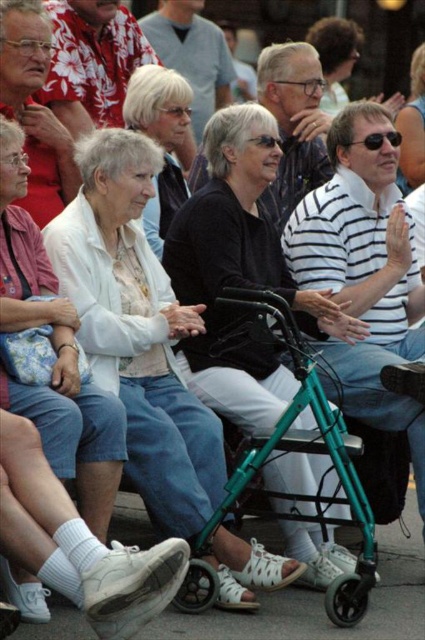
Between white matte walker at center and white textured sweater at center, which one has less height?

white textured sweater at center

Is white matte walker at center below white textured sweater at center?

Correct, white matte walker at center is located below white textured sweater at center.

Image resolution: width=425 pixels, height=640 pixels. Describe the element at coordinates (136, 330) in the screenshot. I see `white matte walker at center` at that location.

This screenshot has height=640, width=425. Find the location of `white matte walker at center`. white matte walker at center is located at coordinates (136, 330).

Does black fabric walker at center have a lesser height compared to matte black sunglasses at upper center?

In fact, black fabric walker at center may be taller than matte black sunglasses at upper center.

Does black fabric walker at center appear on the right side of matte black sunglasses at upper center?

In fact, black fabric walker at center is to the left of matte black sunglasses at upper center.

Which is in front, point (263, 326) or point (408, 131)?

Point (263, 326)

Where is `black fabric walker at center`? black fabric walker at center is located at coordinates (238, 273).

In the scene shown: Does white matte shirt at center appear under white textured sweater at center?

Yes.

Is the position of white matte shirt at center less distant than that of white textured sweater at center?

Yes, it is in front of white textured sweater at center.

Is point (88, 497) in front of point (146, 128)?

Yes, point (88, 497) is in front of point (146, 128).

Identify the location of white matte shirt at center. The width and height of the screenshot is (425, 640). (54, 356).